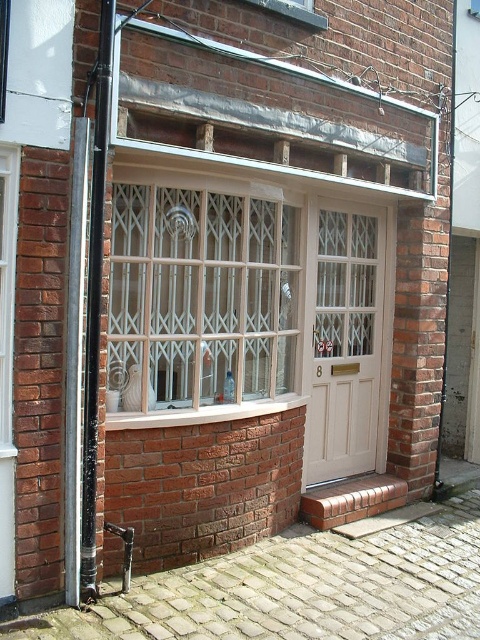
Question: Among these objects, which one is farthest from the camera?

Choices:
 (A) white glass window at left
 (B) clear glass window at center

Answer: (B)

Question: Can you confirm if clear glass window at center is positioned below white wooden door at center?

Choices:
 (A) yes
 (B) no

Answer: (B)

Question: Which of the following is the farthest from the observer?

Choices:
 (A) white wooden door at center
 (B) white glass window at left
 (C) clear glass window at center

Answer: (A)

Question: Can you confirm if clear glass window at center is wider than white wooden door at center?

Choices:
 (A) no
 (B) yes

Answer: (B)

Question: Which object is positioned closest to the white glass window at left?

Choices:
 (A) white wooden door at center
 (B) clear glass window at center

Answer: (B)

Question: Where is clear glass window at center located in relation to white wooden door at center in the image?

Choices:
 (A) right
 (B) left

Answer: (B)